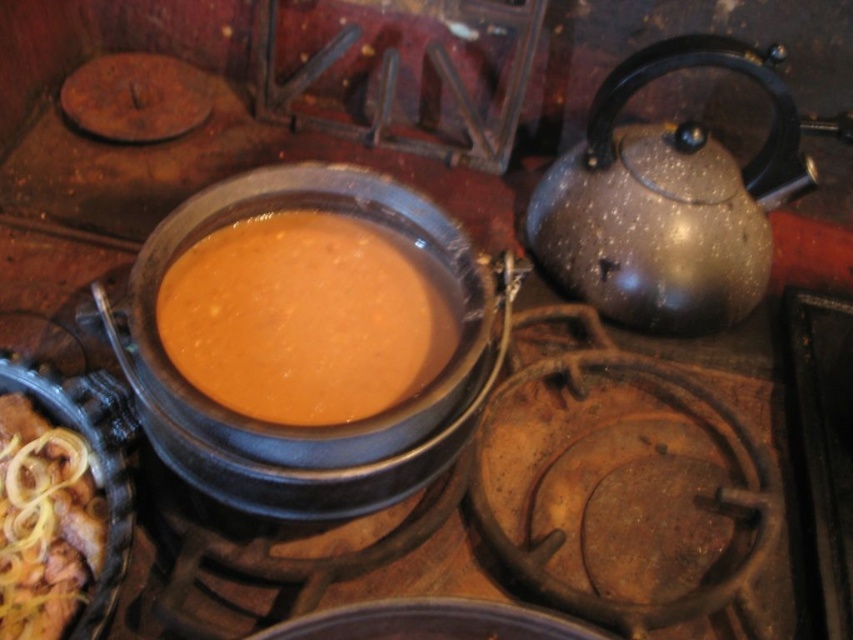
Question: Which of the following is the farthest from the observer?

Choices:
 (A) golden brown crispy onions at lower left
 (B) shiny metallic teapot at right

Answer: (B)

Question: Among these points, which one is nearest to the camera?

Choices:
 (A) (51, 534)
 (B) (556, 196)
 (C) (369, 292)

Answer: (A)

Question: Which of these objects is positioned closest to the shiny metallic teapot at right?

Choices:
 (A) orange matte soup at center
 (B) golden brown crispy onions at lower left

Answer: (A)

Question: Is orange matte soup at center positioned at the back of golden brown crispy onions at lower left?

Choices:
 (A) no
 (B) yes

Answer: (A)

Question: Does shiny metallic teapot at right lie behind golden brown crispy onions at lower left?

Choices:
 (A) yes
 (B) no

Answer: (A)

Question: Can you confirm if shiny metallic teapot at right is positioned above golden brown crispy onions at lower left?

Choices:
 (A) yes
 (B) no

Answer: (A)